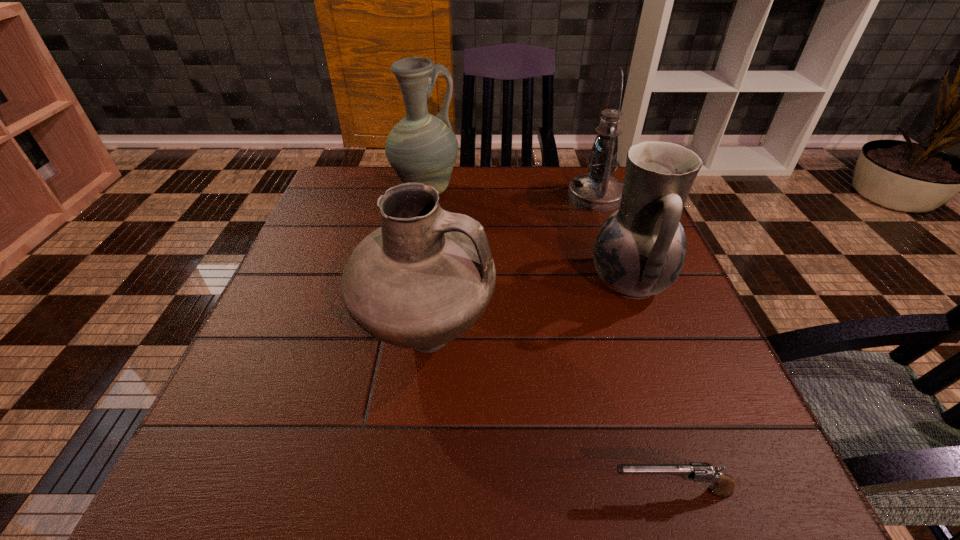
The height and width of the screenshot is (540, 960). In order to click on free space located aiming along the barrel of the shortest object in this screenshot , I will do `click(564, 491)`.

The height and width of the screenshot is (540, 960). I want to click on vacant space located 0.200m aiming along the barrel of the shortest object, so click(x=463, y=491).

This screenshot has height=540, width=960. In order to click on vacant space positioned 0.090m aiming along the barrel of the shortest object in this screenshot , I will do tap(543, 491).

At what (x,y) coordinates should I click in order to perform the action: click on pitcher present at the far edge. Please return your answer as a coordinate pair (x, y). Looking at the image, I should click on (421, 148).

I want to click on oil lamp located in the far edge section of the desktop, so click(x=597, y=191).

The image size is (960, 540). Find the location of `object present at the near edge`. object present at the near edge is located at coordinates (723, 486).

Identify the location of oil lamp that is at the right edge. This screenshot has height=540, width=960. coord(597,191).

Locate an element on the screen. pitcher present at the right edge is located at coordinates (640, 250).

Image resolution: width=960 pixels, height=540 pixels. Identify the location of gun present at the right edge. pyautogui.click(x=723, y=486).

Locate an element on the screen. This screenshot has height=540, width=960. object at the far right corner is located at coordinates (597, 191).